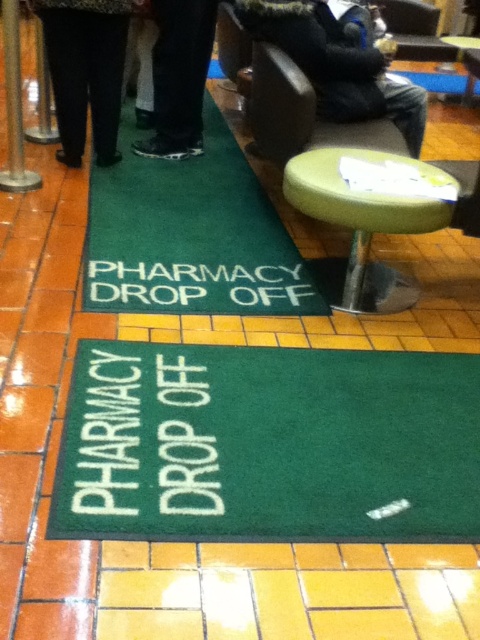
Is green carpet at center smaller than dark blue jeans at center?

Actually, green carpet at center might be larger than dark blue jeans at center.

Describe the element at coordinates (190, 236) in the screenshot. The image size is (480, 640). I see `green carpet at center` at that location.

Find the location of `green carpet at center`. green carpet at center is located at coordinates (190, 236).

Who is more distant from viewer, (85, 266) or (339, 209)?

The point (85, 266) is behind.

Find the location of a particular element. This screenshot has width=480, height=640. green carpet at center is located at coordinates (190, 236).

Is green rubber mat at center positioned before green fabric stool at center?

That is True.

Can you confirm if green rubber mat at center is positioned below green fabric stool at center?

Yes, green rubber mat at center is below green fabric stool at center.

Is point (160, 496) positioned before point (405, 294)?

Yes, it is in front of point (405, 294).

This screenshot has width=480, height=640. What are the coordinates of `green rubber mat at center` in the screenshot? It's located at (267, 445).